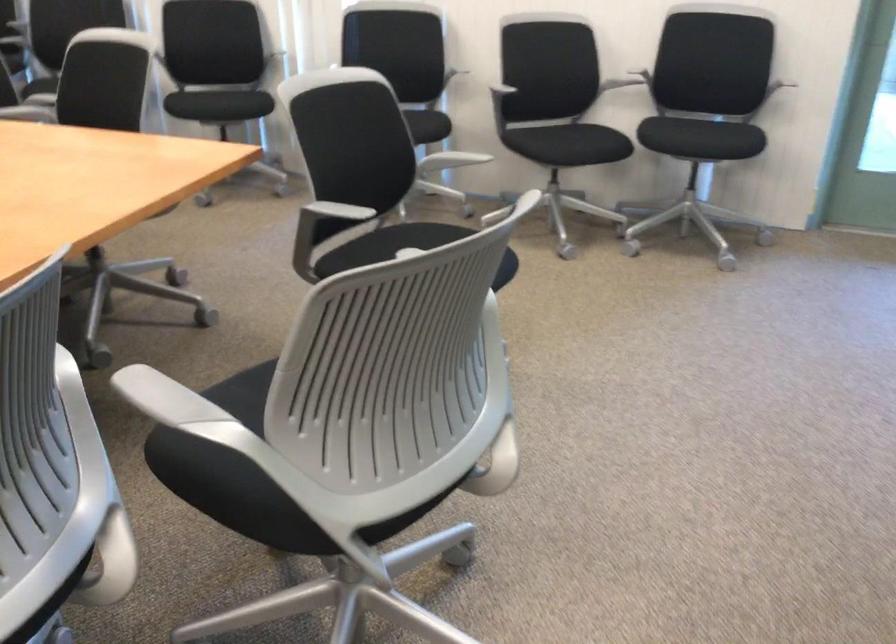
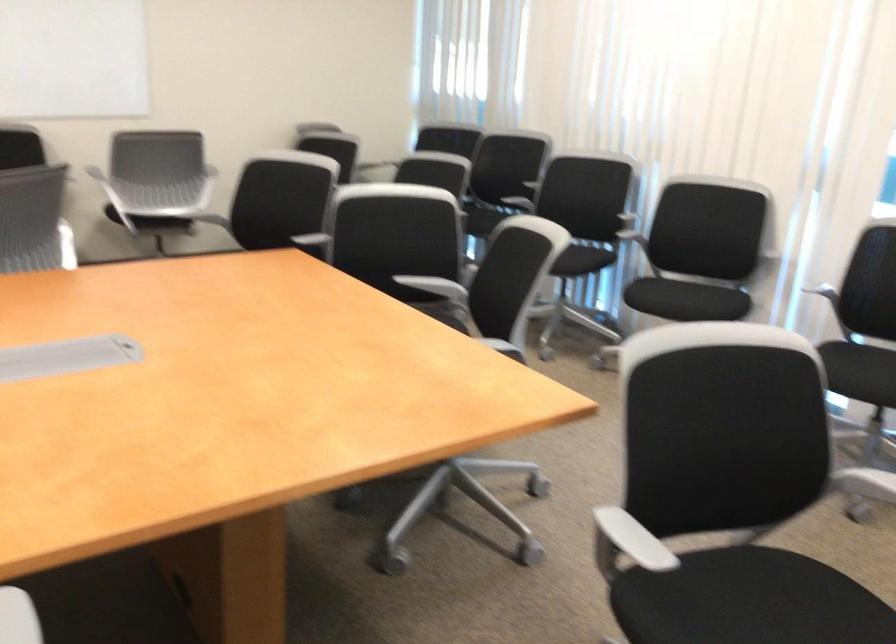
Question: Based on the continuous images, in which direction is the camera rotating? Reply with the corresponding letter.

Choices:
 (A) Left
 (B) Right
 (C) Up
 (D) Down

Answer: (A)